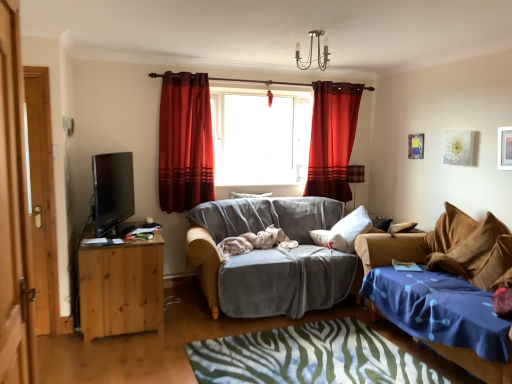
This screenshot has width=512, height=384. I want to click on free space above metallic chandelier at upper center, which is the 2th lamp from bottom to top (from a real-world perspective), so click(320, 29).